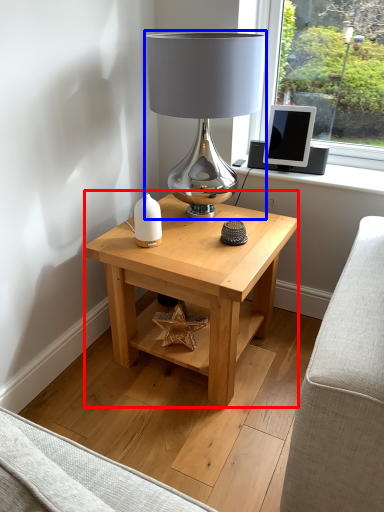
Question: Which point is closer to the camera, table (highlighted by a red box) or lamp (highlighted by a blue box)?

Choices:
 (A) table
 (B) lamp

Answer: (B)